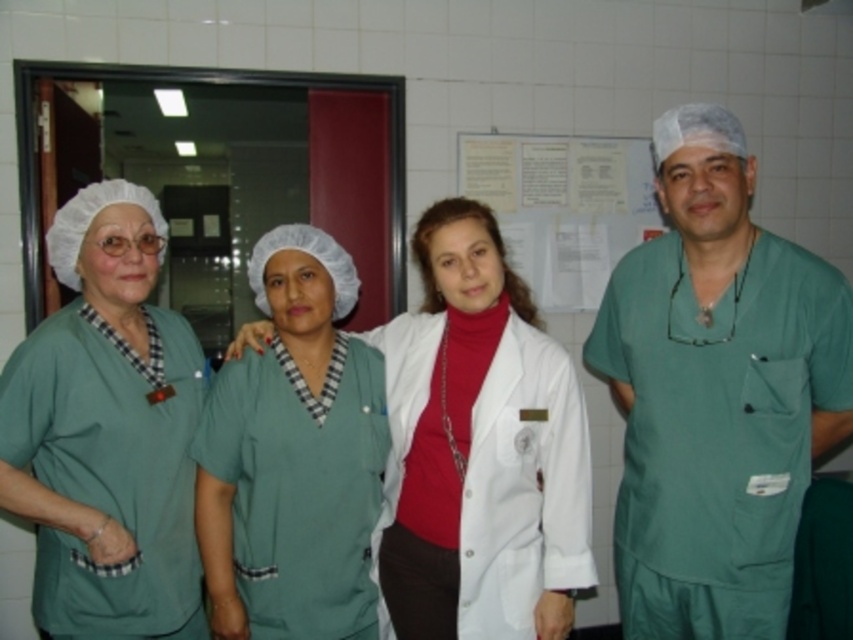
Does matte green scrubs at left have a lesser height compared to white paper at upper center?

No.

Does matte green scrubs at left have a smaller size compared to white paper at upper center?

No.

Between point (44, 502) and point (505, 225), which one is positioned behind?

The point (505, 225) is more distant.

I want to click on matte green scrubs at left, so click(x=106, y=432).

Who is positioned more to the right, white matte lab coat at center or green scrubs at center?

From the viewer's perspective, white matte lab coat at center appears more on the right side.

Can you confirm if white matte lab coat at center is positioned above green scrubs at center?

Indeed, white matte lab coat at center is positioned over green scrubs at center.

Identify the location of white matte lab coat at center. This screenshot has width=853, height=640. (479, 449).

Find the location of a particular element. This screenshot has width=853, height=640. white matte lab coat at center is located at coordinates (479, 449).

Which is more to the right, green scrubs at center or white paper at upper center?

white paper at upper center

Is green scrubs at center to the left of white paper at upper center from the viewer's perspective?

Correct, you'll find green scrubs at center to the left of white paper at upper center.

At what (x,y) coordinates should I click in order to perform the action: click on green scrubs at center. Please return your answer as a coordinate pair (x, y). Looking at the image, I should click on (293, 456).

Where is `green scrubs at center`? green scrubs at center is located at coordinates (293, 456).